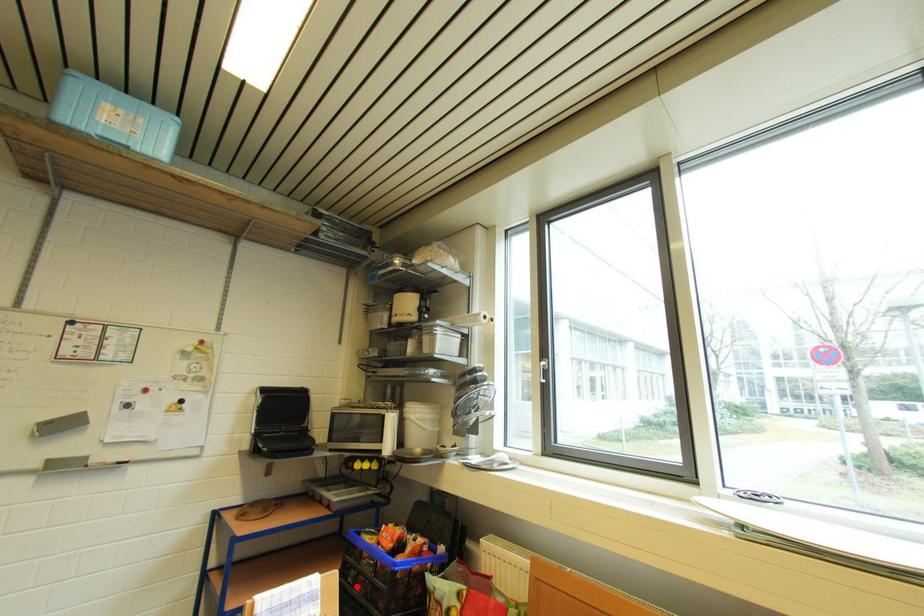
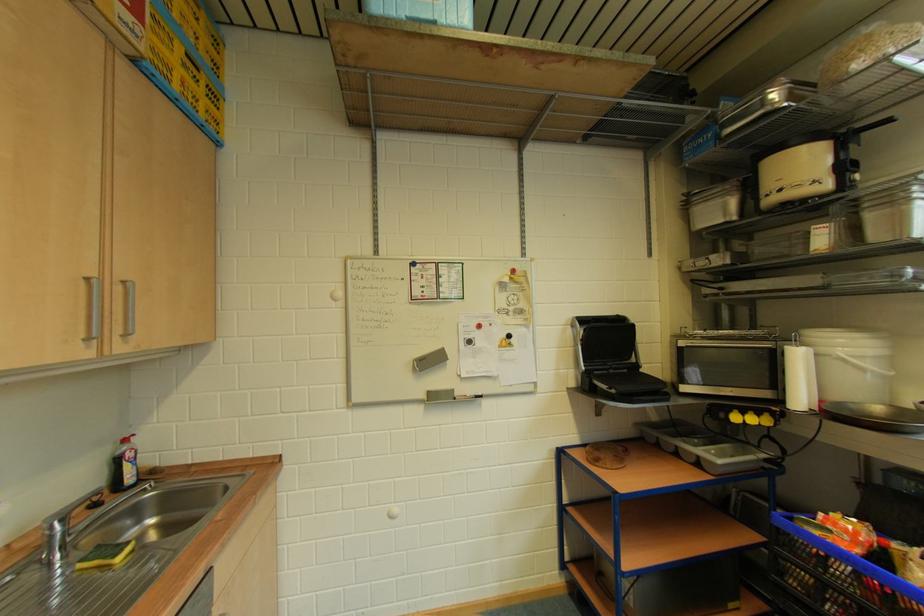
Question: A red point is marked in image1. In image2, is the corresponding 3D point closer to the camera or farther? Reply with the corresponding letter.

Choices:
 (A) The corresponding 3D point is closer.
 (B) The corresponding 3D point is farther.

Answer: (B)